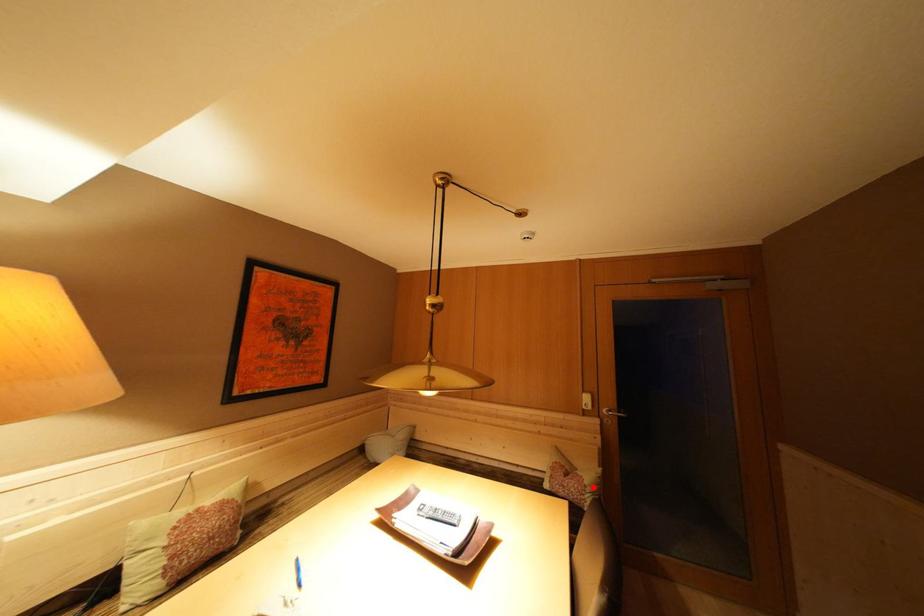
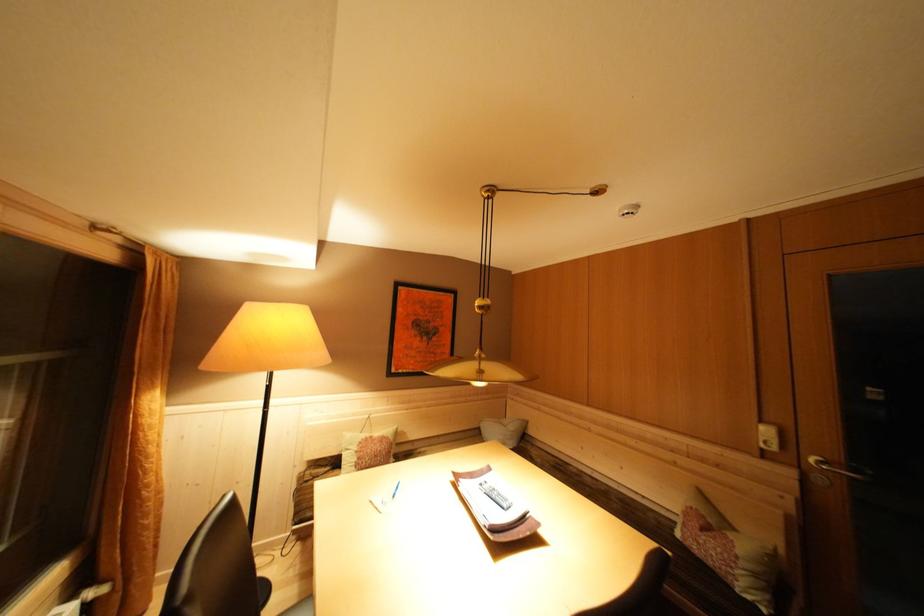
Question: A red point is marked in image1. In image2, is the corresponding 3D point closer to the camera or farther? Reply with the corresponding letter.

Choices:
 (A) The corresponding 3D point is closer.
 (B) The corresponding 3D point is farther.

Answer: (A)